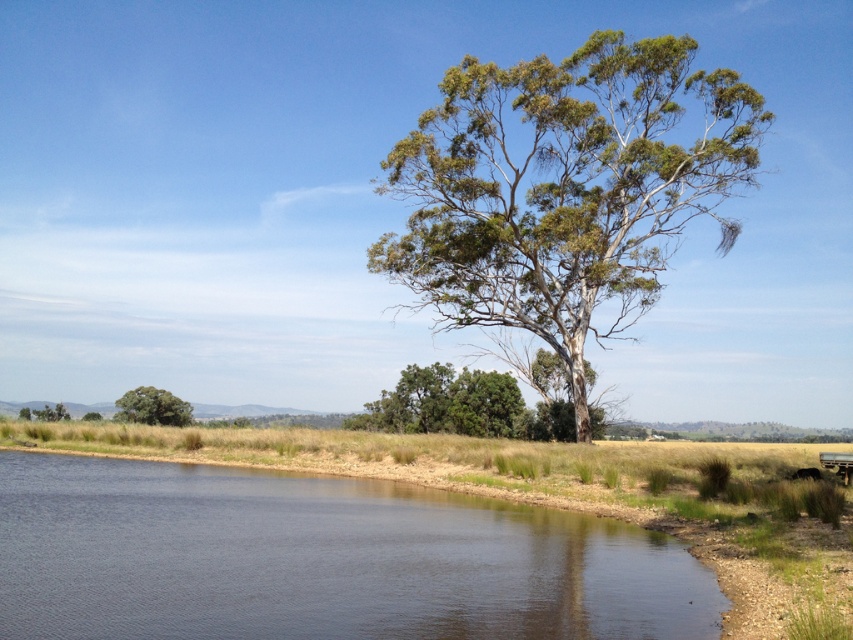
Question: Which of the following is the closest to the observer?

Choices:
 (A) (62, 600)
 (B) (136, 410)
 (C) (44, 420)

Answer: (A)

Question: Can you confirm if green matte tree at lower left is positioned to the right of green leafy tree at lower left?

Choices:
 (A) yes
 (B) no

Answer: (A)

Question: Is dark blue water at lower left above green matte tree at lower left?

Choices:
 (A) no
 (B) yes

Answer: (B)

Question: Where is green leafy tree at center located in relation to green matte tree at lower left in the image?

Choices:
 (A) above
 (B) below

Answer: (A)

Question: Which point is closer to the camera?

Choices:
 (A) (38, 419)
 (B) (701, 164)
 (C) (19, 490)

Answer: (C)

Question: Which is nearer to the green leafy tree at lower left?

Choices:
 (A) dark blue water at lower left
 (B) green leafy tree at center

Answer: (B)